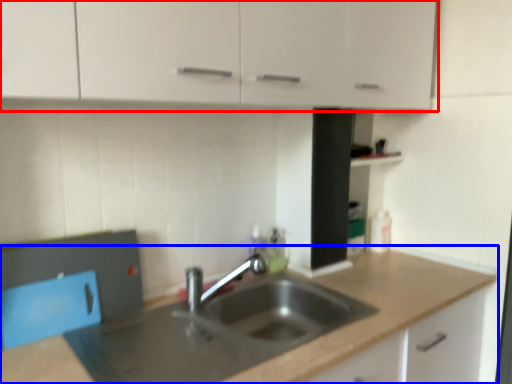
Question: Which of the following is the farthest to the observer, cabinetry (highlighted by a red box) or countertop (highlighted by a blue box)?

Choices:
 (A) cabinetry
 (B) countertop

Answer: (B)